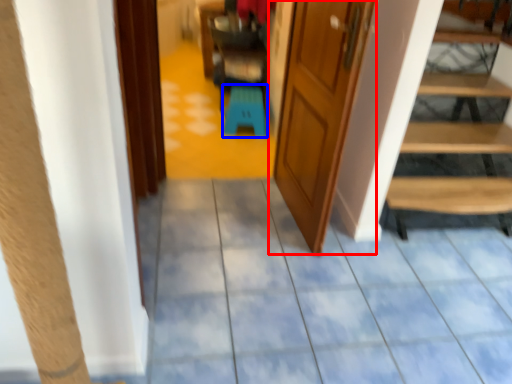
Question: Which of the following is the farthest to the observer, door (highlighted by a red box) or stool (highlighted by a blue box)?

Choices:
 (A) door
 (B) stool

Answer: (B)